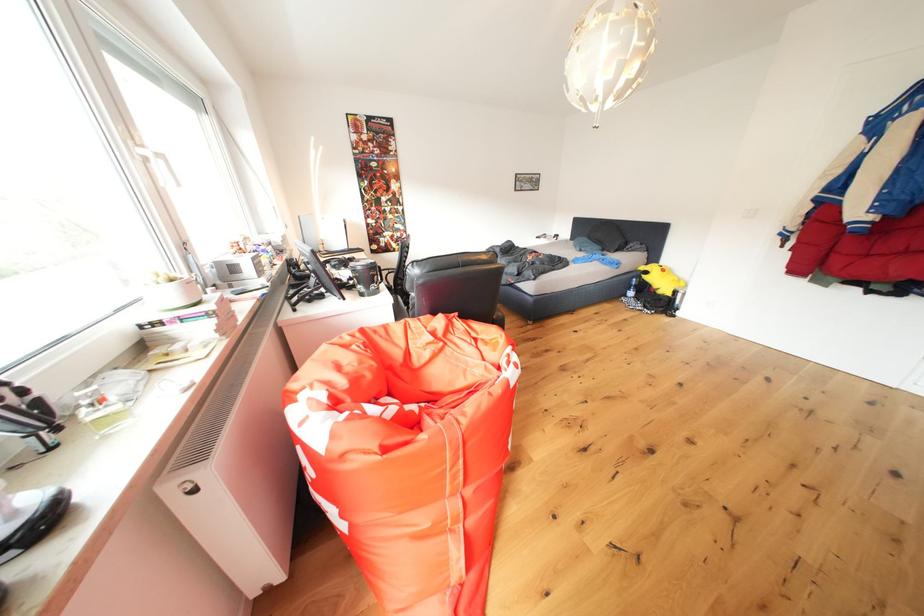
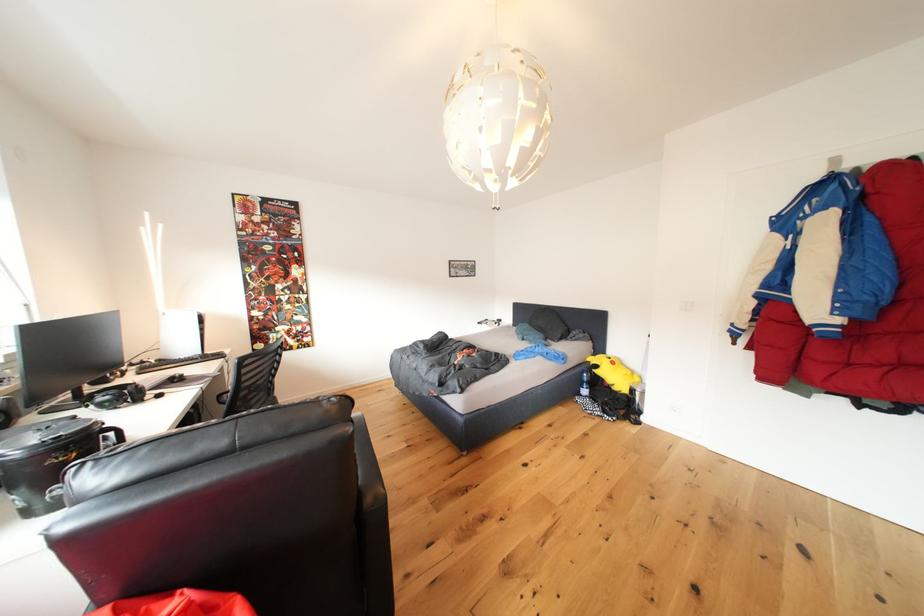
Which direction would the cameraman need to move to produce the second image?

The cameraman walked toward right, forward.